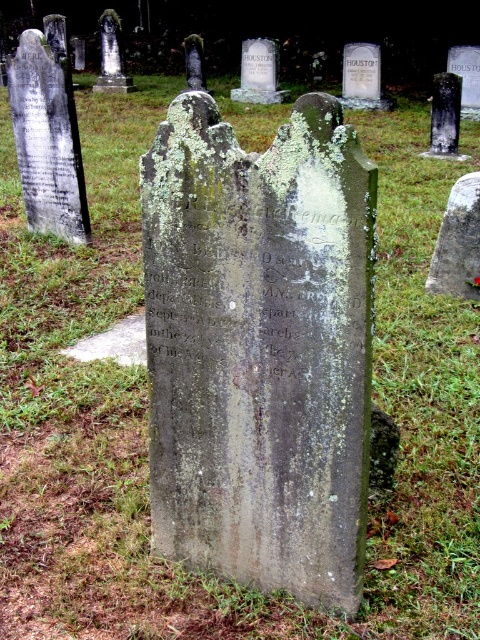
You are standing in a cemetery and see the gray stone gravestone at center and the green mossy stone at center. Which one is more to the left?

The gray stone gravestone at center is positioned on the left side of green mossy stone at center, so it is more to the left.